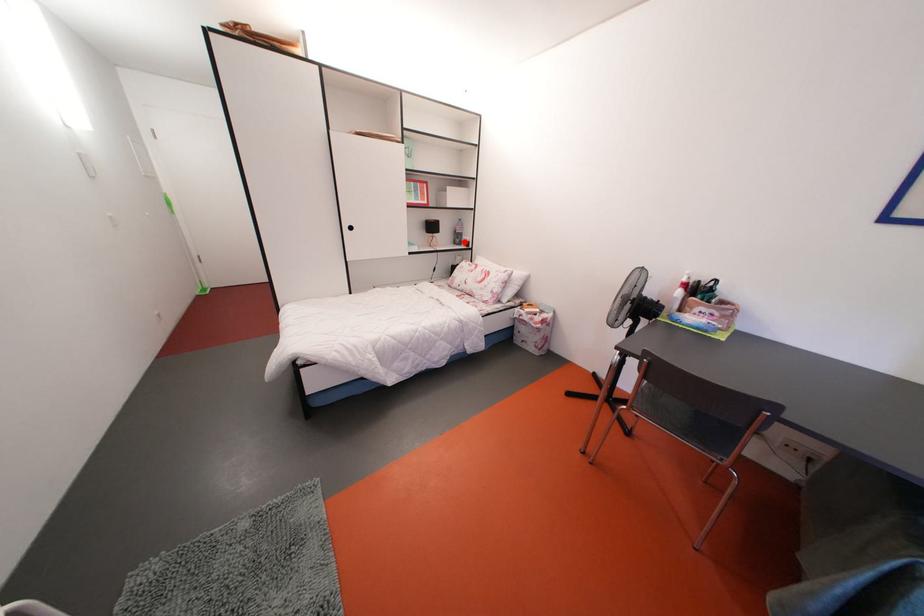
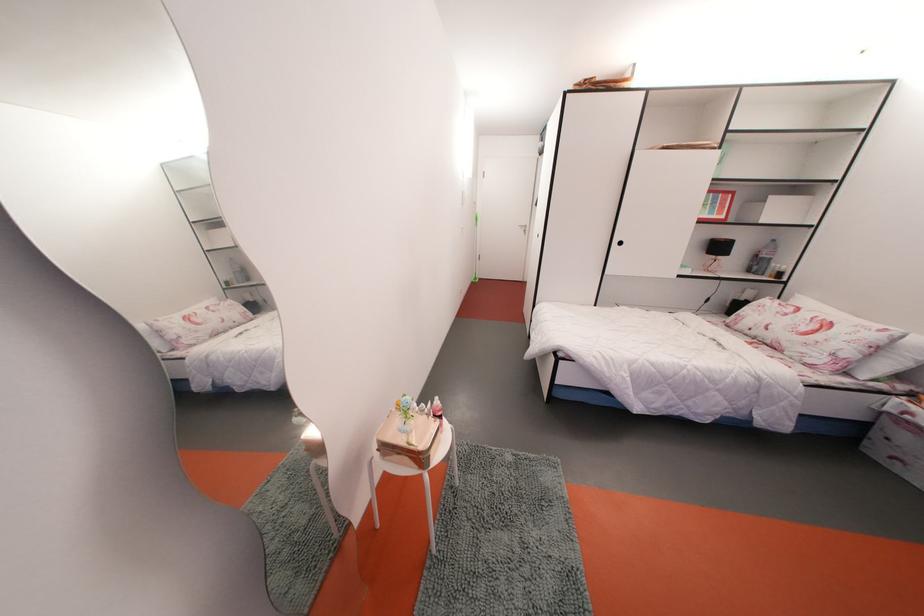
Question: A red point is marked in image1. In image2, is the corresponding 3D point closer to the camera or farther? Reply with the corresponding letter.

Choices:
 (A) The corresponding 3D point is closer.
 (B) The corresponding 3D point is farther.

Answer: (B)